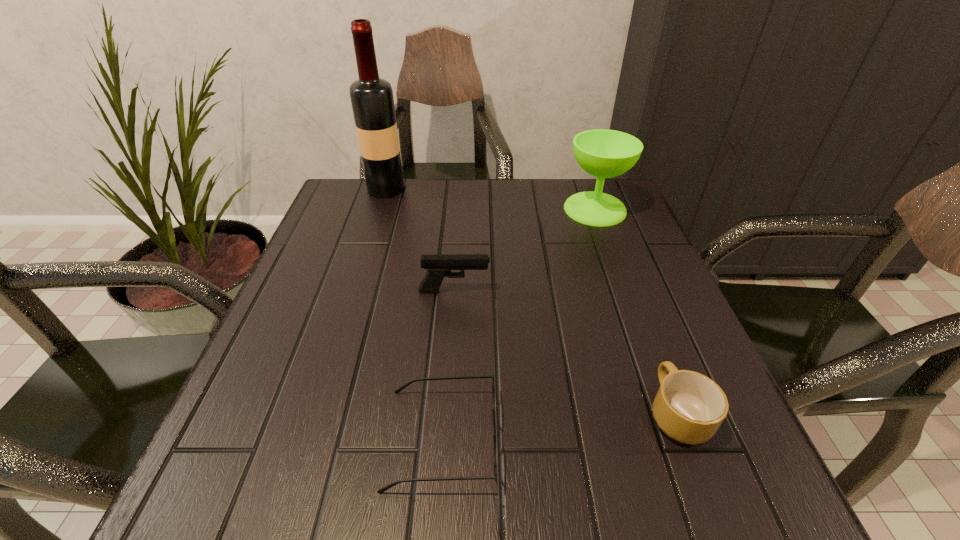
You are a GUI agent. You are given a task and a screenshot of the screen. Output one action in this format:
    pyautogui.click(x=<x>, y=<y>)
    Task: Click on the free spot located 0.210m on the side with the handle of the second shortest object
    
    Given the screenshot: What is the action you would take?
    pyautogui.click(x=632, y=295)

At what (x,y) coordinates should I click in order to perform the action: click on free spot located on the side with the handle of the second shortest object. Please return your answer as a coordinate pair (x, y). Looking at the image, I should click on (623, 271).

Identify the location of vacant space located on the side with the handle of the second shortest object. (x=636, y=306).

Where is `free space located 0.080m on the front-facing side of the shortest object`? free space located 0.080m on the front-facing side of the shortest object is located at coordinates (549, 439).

You are a GUI agent. You are given a task and a screenshot of the screen. Output one action in this format:
    pyautogui.click(x=<x>, y=<y>)
    Task: Click on the wine bottle situated at the far edge
    This screenshot has width=960, height=540.
    Given the screenshot: What is the action you would take?
    pyautogui.click(x=372, y=101)

You are a GUI agent. You are given a task and a screenshot of the screen. Output one action in this format:
    pyautogui.click(x=<x>, y=<y>)
    Task: Click on the wineglass that is at the far edge
    The image size is (960, 540).
    Given the screenshot: What is the action you would take?
    (x=603, y=153)

Where is `object present at the near edge`? object present at the near edge is located at coordinates (401, 388).

This screenshot has width=960, height=540. I want to click on object present at the left edge, so click(x=372, y=101).

I want to click on wineglass positioned at the right edge, so click(x=603, y=153).

You are a GUI agent. You are given a task and a screenshot of the screen. Output one action in this format:
    pyautogui.click(x=<x>, y=<y>)
    Task: Click on the mug located in the right edge section of the desktop
    This screenshot has height=540, width=960.
    Given the screenshot: What is the action you would take?
    pyautogui.click(x=689, y=407)